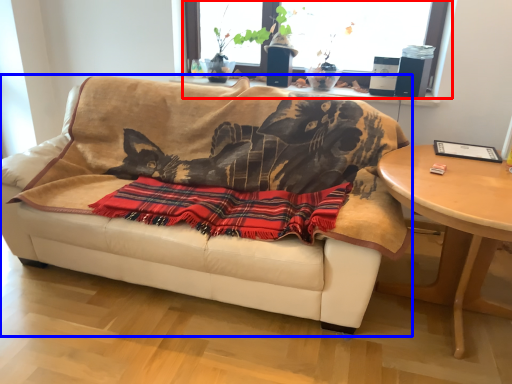
Question: Among these objects, which one is nearest to the camera, window (highlighted by a red box) or studio couch (highlighted by a blue box)?

Choices:
 (A) window
 (B) studio couch

Answer: (B)